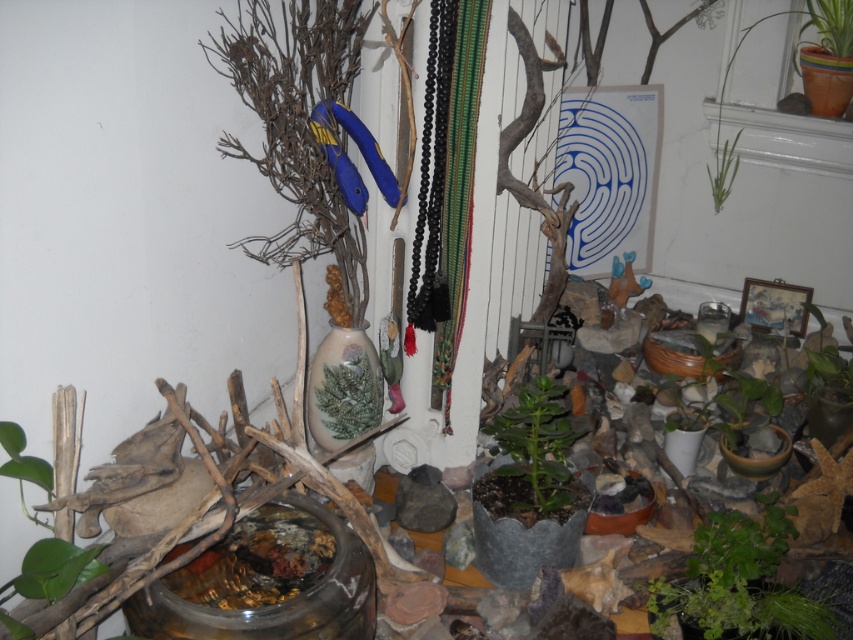
What do you see at coordinates (740, 580) in the screenshot? I see `green leafy plant at lower right` at bounding box center [740, 580].

Can you confirm if green leafy plant at lower right is shorter than green matte plant at center-right?

Indeed, green leafy plant at lower right has a lesser height compared to green matte plant at center-right.

Which is behind, point (764, 557) or point (740, 438)?

The point (740, 438) is more distant.

Where is `green leafy plant at lower right`? Image resolution: width=853 pixels, height=640 pixels. green leafy plant at lower right is located at coordinates (740, 580).

Who is positioned more to the left, green matte plant at center or green matte plant at center-right?

From the viewer's perspective, green matte plant at center appears more on the left side.

Does green matte plant at center appear on the left side of green matte plant at center-right?

Correct, you'll find green matte plant at center to the left of green matte plant at center-right.

Which is in front, point (500, 426) or point (660, 365)?

Point (500, 426) is more forward.

This screenshot has height=640, width=853. Find the location of `green matte plant at center`. green matte plant at center is located at coordinates (532, 458).

You are a GUI agent. You are given a task and a screenshot of the screen. Output one action in this format:
    pyautogui.click(x=<x>, y=<y>)
    Task: Click on the green leafy plant at lower right
    Image resolution: width=853 pixels, height=640 pixels.
    Given the screenshot: What is the action you would take?
    pyautogui.click(x=740, y=580)

In the scene shown: Who is lower down, green leafy plant at lower right or green matte plant at center?

green leafy plant at lower right is lower down.

Does point (785, 598) lie behind point (509, 492)?

No.

Locate an element on the screen. The width and height of the screenshot is (853, 640). green leafy plant at lower right is located at coordinates (740, 580).